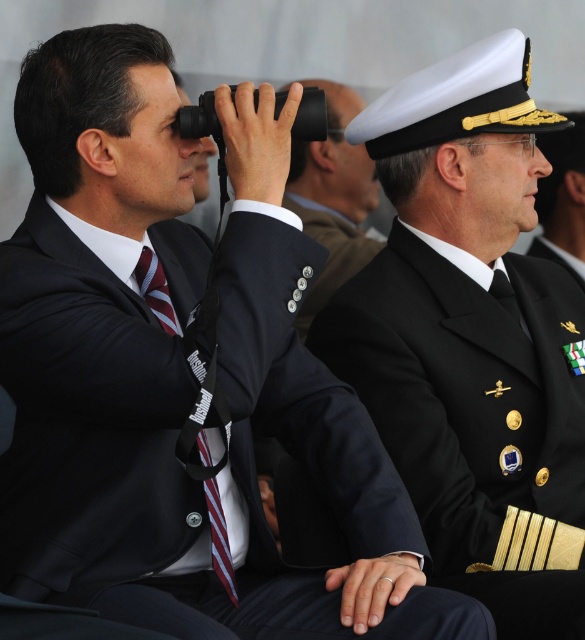
Is matte black binoculars at center to the left of striped fabric tie at center from the viewer's perspective?

Incorrect, matte black binoculars at center is not on the left side of striped fabric tie at center.

Image resolution: width=585 pixels, height=640 pixels. Identify the location of matte black binoculars at center. (332, 196).

Measure the distance between point (369, 211) and camera.

A distance of 5.48 meters exists between point (369, 211) and camera.

Locate an element on the screen. This screenshot has height=640, width=585. matte black binoculars at center is located at coordinates (332, 196).

Is black matte uniform at center to the right of matte black binoculars at center from the viewer's perspective?

Indeed, black matte uniform at center is positioned on the right side of matte black binoculars at center.

Consider the image. Between black matte uniform at center and matte black binoculars at center, which one appears on the left side from the viewer's perspective?

Positioned to the left is matte black binoculars at center.

I want to click on black matte uniform at center, so click(x=473, y=339).

Find the location of a particular element. The height and width of the screenshot is (640, 585). black matte uniform at center is located at coordinates (473, 339).

Between black matte uniform at center and striped fabric tie at center, which one appears on the left side from the viewer's perspective?

Positioned to the left is striped fabric tie at center.

What do you see at coordinates (473, 339) in the screenshot? I see `black matte uniform at center` at bounding box center [473, 339].

Who is more forward, [511,369] or [142,252]?

Point [142,252]

Image resolution: width=585 pixels, height=640 pixels. Find the location of `black matte uniform at center`. black matte uniform at center is located at coordinates pos(473,339).